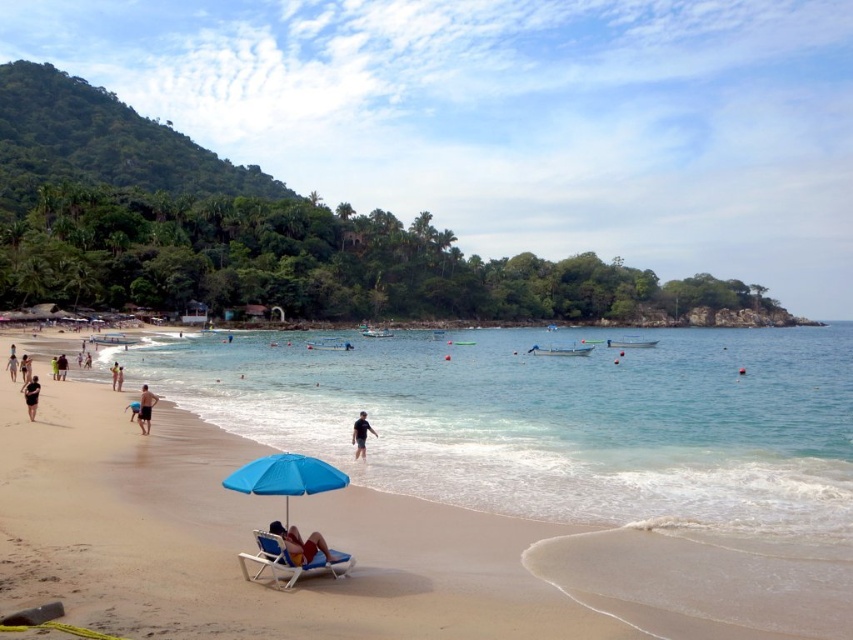
You are standing on the beach and want to find the dark blue fabric umbrella at center. Based on the coordinates provided, which object is located at point (61,365)?

The point (61,365) corresponds to the dark blue fabric umbrella at center.